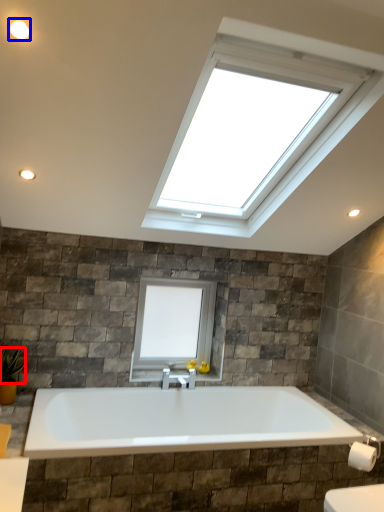
Question: Among these objects, which one is farthest to the camera, plant (highlighted by a red box) or lighting (highlighted by a blue box)?

Choices:
 (A) plant
 (B) lighting

Answer: (A)